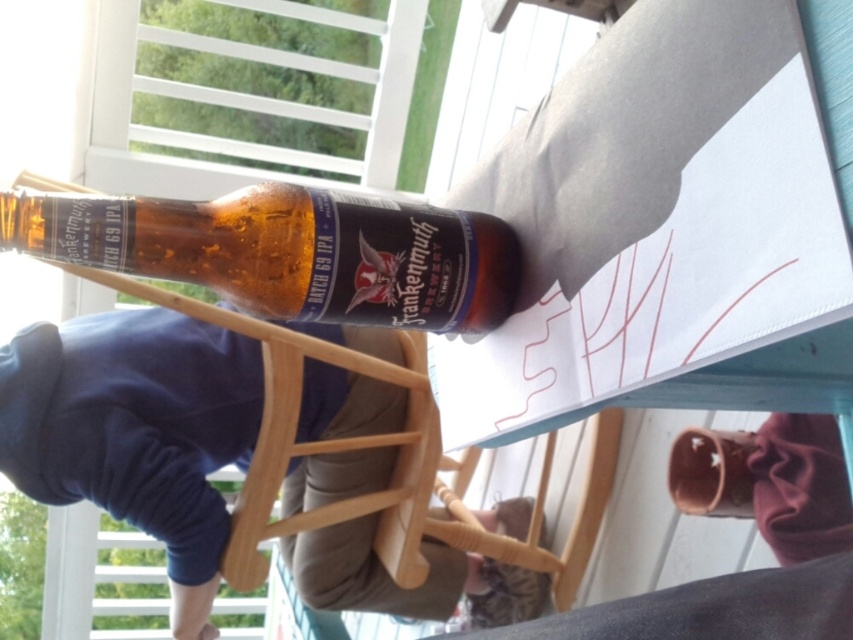
Consider the image. Does blue cotton pants at lower center have a lesser height compared to translucent amber glass bottle at center?

No.

Does point (308, 531) come closer to viewer compared to point (403, 230)?

That is False.

Is point (212, 396) positioned behind point (97, 241)?

Yes, it is behind point (97, 241).

This screenshot has width=853, height=640. I want to click on blue cotton pants at lower center, so click(x=132, y=422).

Who is taller, blue cotton pants at lower center or translucent glass cup at lower right?

blue cotton pants at lower center is taller.

Is point (207, 458) less distant than point (700, 493)?

No, it is behind (700, 493).

Image resolution: width=853 pixels, height=640 pixels. In order to click on blue cotton pants at lower center in this screenshot , I will do `click(132, 422)`.

Between translucent amber glass bottle at center and translucent glass cup at lower right, which one is positioned higher?

translucent amber glass bottle at center is higher up.

Is the position of translucent amber glass bottle at center more distant than that of translucent glass cup at lower right?

That is False.

This screenshot has width=853, height=640. Identify the location of translucent amber glass bottle at center. (289, 252).

You are a GUI agent. You are given a task and a screenshot of the screen. Output one action in this format:
    pyautogui.click(x=<x>, y=<y>)
    Task: Click on the translucent amber glass bottle at center
    Image resolution: width=853 pixels, height=640 pixels.
    Given the screenshot: What is the action you would take?
    pyautogui.click(x=289, y=252)